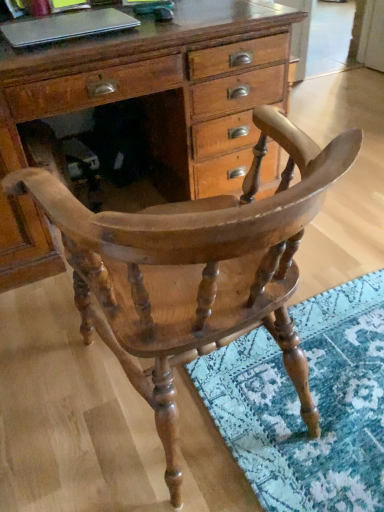
Question: Considering the relative sizes of wooden chest of drawers at center and silver metallic laptop at upper left in the image provided, is wooden chest of drawers at center wider than silver metallic laptop at upper left?

Choices:
 (A) yes
 (B) no

Answer: (A)

Question: Is wooden chest of drawers at center oriented towards silver metallic laptop at upper left?

Choices:
 (A) yes
 (B) no

Answer: (B)

Question: Considering the relative positions of wooden chest of drawers at center and silver metallic laptop at upper left in the image provided, is wooden chest of drawers at center to the right of silver metallic laptop at upper left from the viewer's perspective?

Choices:
 (A) no
 (B) yes

Answer: (B)

Question: Does wooden chest of drawers at center have a lesser height compared to silver metallic laptop at upper left?

Choices:
 (A) no
 (B) yes

Answer: (A)

Question: Does wooden chest of drawers at center come in front of silver metallic laptop at upper left?

Choices:
 (A) yes
 (B) no

Answer: (A)

Question: From a real-world perspective, is wooden chest of drawers at center below silver metallic laptop at upper left?

Choices:
 (A) no
 (B) yes

Answer: (B)

Question: Does silver metallic laptop at upper left have a greater width compared to wooden chest of drawers at center?

Choices:
 (A) yes
 (B) no

Answer: (B)

Question: From the image's perspective, is silver metallic laptop at upper left under wooden chest of drawers at center?

Choices:
 (A) yes
 (B) no

Answer: (B)

Question: Is silver metallic laptop at upper left completely or partially outside of wooden chest of drawers at center?

Choices:
 (A) yes
 (B) no

Answer: (A)

Question: From the image's perspective, is silver metallic laptop at upper left located above wooden chest of drawers at center?

Choices:
 (A) no
 (B) yes

Answer: (B)

Question: Is the position of silver metallic laptop at upper left less distant than that of wooden chest of drawers at center?

Choices:
 (A) no
 (B) yes

Answer: (A)

Question: Does silver metallic laptop at upper left have a lesser height compared to wooden chest of drawers at center?

Choices:
 (A) no
 (B) yes

Answer: (B)

Question: Is silver metallic laptop at upper left further to camera compared to wooden chair at center?

Choices:
 (A) no
 (B) yes

Answer: (B)